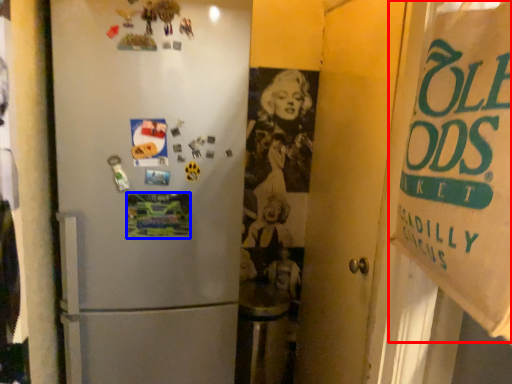
Question: Which point is further to the camera, poster (highlighted by a red box) or postcard (highlighted by a blue box)?

Choices:
 (A) poster
 (B) postcard

Answer: (B)